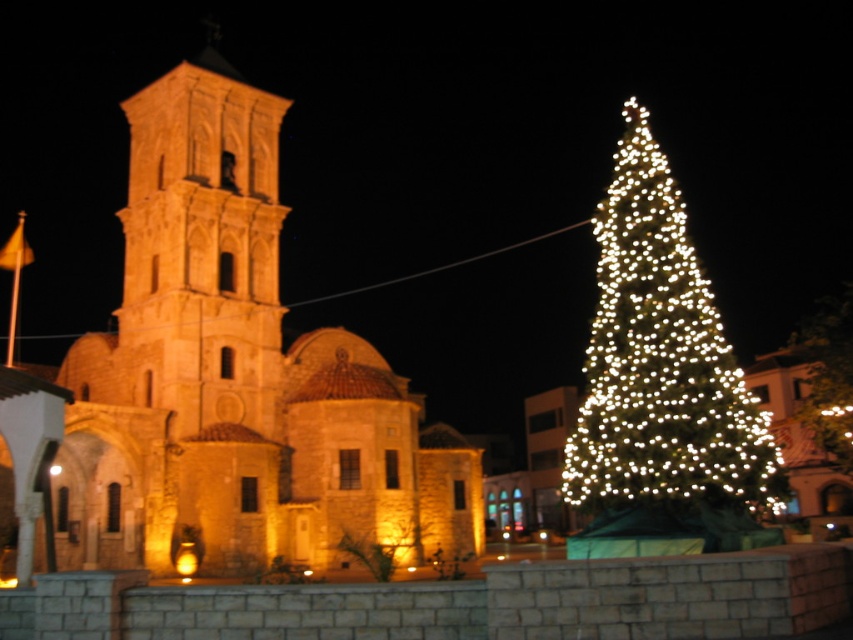
You are standing at point (660, 358) in the image. What object is directly in front of you?

The illuminated green pine at right is directly in front of you at point (660, 358).

You are standing in front of the golden stone church at center and want to walk towards the illuminated green pine at right. Which direction should you move to reach the tree?

The golden stone church at center is below the illuminated green pine at right, so you should move upwards to reach the tree.